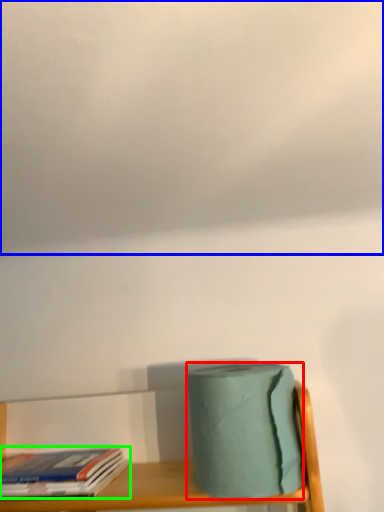
Question: Based on their relative distances, which object is farther from toilet paper (highlighted by a red box)? Choose from cloud (highlighted by a blue box) and book (highlighted by a green box).

Choices:
 (A) cloud
 (B) book

Answer: (A)